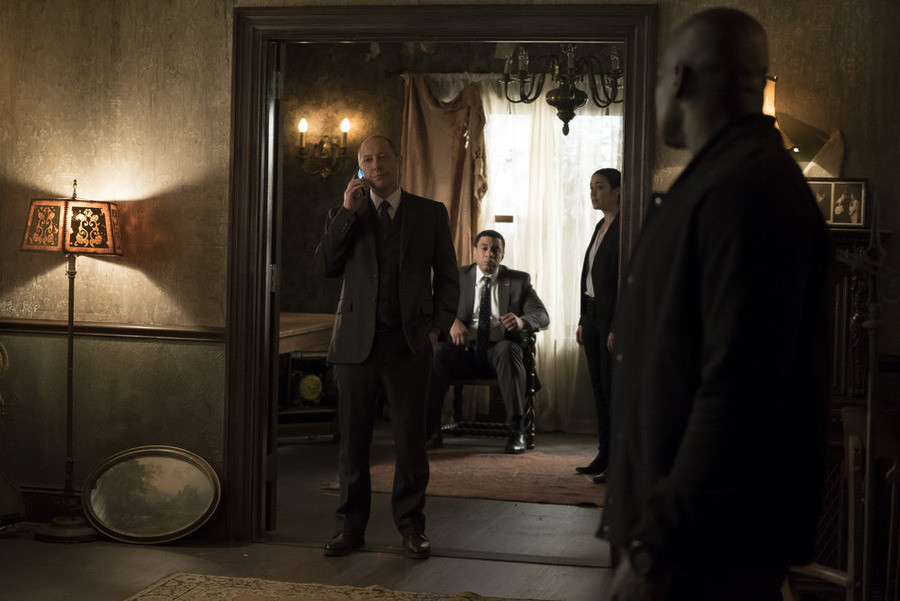
Find the location of a particular element. chandilier is located at coordinates (559, 92).